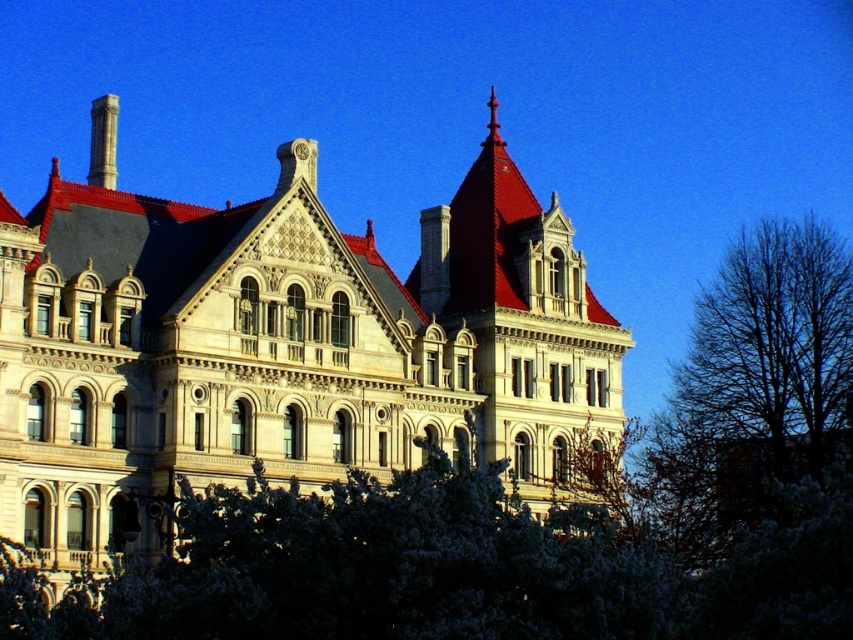
You are a photographer standing at the camera position. You want to capture a closeup shot of the white textured leaves at center. Considering your current distance, is it possible to get a clear closeup without moving closer?

The white textured leaves at center is 39.31 meters from camera, so it would be difficult to capture a clear closeup without moving closer or using a telephoto lens.

You are a photographer planning to capture the stone building at center and the white textured leaves at center in a single shot. Based on their sizes in the image, which object would appear larger in your photo?

The stone building at center is taller than white textured leaves at center, so it would appear larger in the photo.